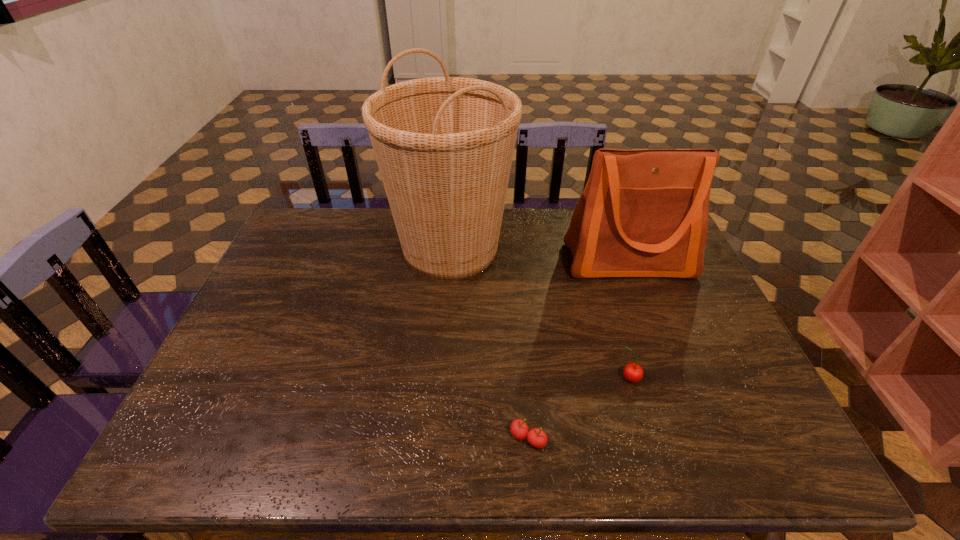
The width and height of the screenshot is (960, 540). I want to click on blank space at the near left corner of the desktop, so click(x=219, y=458).

Image resolution: width=960 pixels, height=540 pixels. Find the location of `free space that is in between the second shortest object and the nearer cherry`. free space that is in between the second shortest object and the nearer cherry is located at coordinates (579, 409).

This screenshot has width=960, height=540. Identify the location of free spot between the nearest object and the shopping bag. tap(578, 349).

At what (x,y) coordinates should I click in order to perform the action: click on free space between the shopping bag and the tallest object. Please return your answer as a coordinate pair (x, y). This screenshot has width=960, height=540. Looking at the image, I should click on (540, 255).

Image resolution: width=960 pixels, height=540 pixels. Identify the location of vacant point located between the tallest object and the shorter cherry. (490, 344).

Identify the location of free space between the nearer cherry and the second nearest object. The image size is (960, 540). pos(579,409).

The height and width of the screenshot is (540, 960). I want to click on free space that is in between the second tallest object and the farther cherry, so click(x=629, y=320).

You are a GUI agent. You are given a task and a screenshot of the screen. Output one action in this format:
    pyautogui.click(x=<x>, y=<y>)
    Task: Click on the free space between the nearer cherry and the shopping bag
    This screenshot has height=540, width=960.
    Given the screenshot: What is the action you would take?
    pyautogui.click(x=578, y=349)

What are the coordinates of `free area in between the shopping bag and the nearest object` in the screenshot? It's located at (578, 349).

Locate an element on the screen. The image size is (960, 540). vacant point located between the taller cherry and the shopping bag is located at coordinates (629, 320).